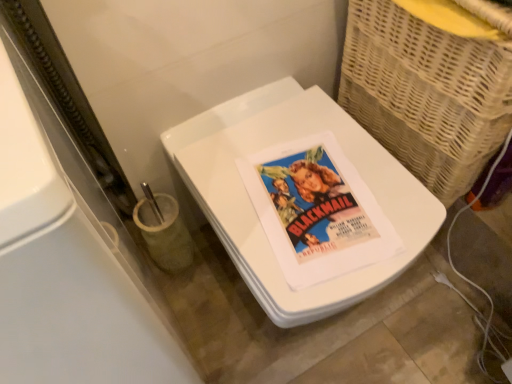
Where is `unoccupied space behind matte paper poster at center`? The height and width of the screenshot is (384, 512). unoccupied space behind matte paper poster at center is located at coordinates (298, 132).